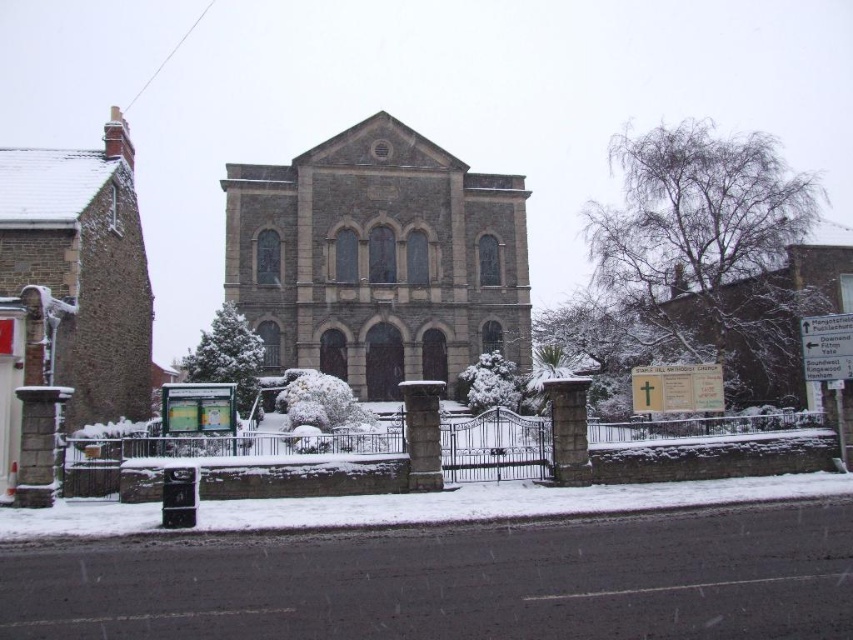
The image size is (853, 640). Describe the element at coordinates (378, 259) in the screenshot. I see `brown stone church at center` at that location.

Can you confirm if brown stone church at center is bigger than brown stone church at left?

No.

The width and height of the screenshot is (853, 640). What are the coordinates of `brown stone church at center` in the screenshot? It's located at 378,259.

This screenshot has width=853, height=640. In order to click on brown stone church at center in this screenshot , I will do `click(378, 259)`.

Based on the photo, is brown stone church at left thinner than white powdery snow at lower center?

Yes.

Is brown stone church at left to the left of white powdery snow at lower center from the viewer's perspective?

Correct, you'll find brown stone church at left to the left of white powdery snow at lower center.

Does point (111, 145) come farther from viewer compared to point (378, 500)?

Yes, point (111, 145) is farther from viewer.

Find the location of a particular element. brown stone church at left is located at coordinates (73, 284).

Does brown stone church at center have a larger size compared to white powdery snow at lower center?

Yes, brown stone church at center is bigger than white powdery snow at lower center.

Between point (354, 154) and point (360, 516), which one is positioned behind?

The point (354, 154) is behind.

Find the location of a particular element. The image size is (853, 640). brown stone church at center is located at coordinates (378, 259).